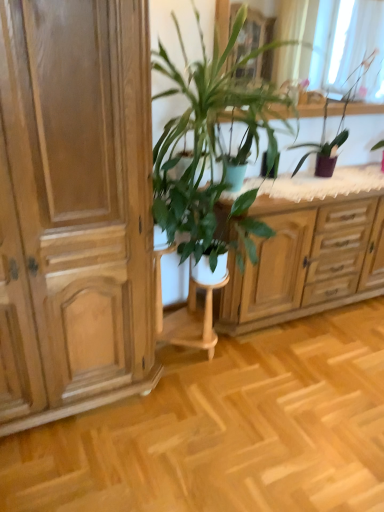
What do you see at coordinates (264, 165) in the screenshot? This screenshot has width=384, height=512. I see `green matte flowerpot at center` at bounding box center [264, 165].

What do you see at coordinates (337, 128) in the screenshot? Image resolution: width=384 pixels, height=512 pixels. I see `purple glossy vase at upper right, which ranks as the second houseplant in left-to-right order` at bounding box center [337, 128].

Identify the location of light wood cabinet at center. Image resolution: width=384 pixels, height=512 pixels. pyautogui.click(x=302, y=266).

Is translucent fabric at upper center oriented away from green matte flowerpot at center?

No, translucent fabric at upper center is not facing the opposite direction of green matte flowerpot at center.

Are translucent fabric at upper center and green matte flowerpot at center making contact?

No, translucent fabric at upper center is not next to green matte flowerpot at center.

Is translucent fabric at upper center taller or shorter than green matte flowerpot at center?

In the image, translucent fabric at upper center appears to be taller than green matte flowerpot at center.

From a real-world perspective, who is located higher, translucent fabric at upper center or green matte flowerpot at center?

From a 3D spatial view, translucent fabric at upper center is above.

Considering the points (91, 190) and (293, 277), which point is in front, point (91, 190) or point (293, 277)?

The point (91, 190) is in front.

Is light brown wood cabinet at left spatially inside light wood cabinet at center, or outside of it?

light brown wood cabinet at left is not inside light wood cabinet at center, it's outside.

Where is `cabinetry above the light wood cabinet at center (from the image's perspective)`? The height and width of the screenshot is (512, 384). cabinetry above the light wood cabinet at center (from the image's perspective) is located at coordinates (75, 208).

Consider the image. Is light brown wood cabinet at left not close to light wood cabinet at center?

Yes, light brown wood cabinet at left and light wood cabinet at center are located far from each other.

Based on the photo, is translucent fabric at upper center directly adjacent to purple glossy vase at upper right, which is the first houseplant from right to left?

No, translucent fabric at upper center is not beside purple glossy vase at upper right, which is the first houseplant from right to left.

Is translucent fabric at upper center to the left of purple glossy vase at upper right, which is the first houseplant from right to left, from the viewer's perspective?

Indeed, translucent fabric at upper center is positioned on the left side of purple glossy vase at upper right, which is the first houseplant from right to left.

How distant is translucent fabric at upper center from purple glossy vase at upper right, which ranks as the second houseplant in left-to-right order?

A distance of 25.26 inches exists between translucent fabric at upper center and purple glossy vase at upper right, which ranks as the second houseplant in left-to-right order.

From the image's perspective, would you say translucent fabric at upper center is shown under purple glossy vase at upper right, which is the first houseplant from right to left?

No, from the image's perspective, translucent fabric at upper center is not beneath purple glossy vase at upper right, which is the first houseplant from right to left.

Considering the sizes of translucent fabric at upper center and light wood cabinet at center in the image, is translucent fabric at upper center taller or shorter than light wood cabinet at center?

Considering their sizes, translucent fabric at upper center has less height than light wood cabinet at center.

Considering the relative positions of translucent fabric at upper center and light wood cabinet at center in the image provided, is translucent fabric at upper center to the right of light wood cabinet at center from the viewer's perspective?

No, translucent fabric at upper center is not to the right of light wood cabinet at center.

From the image's perspective, is translucent fabric at upper center beneath light wood cabinet at center?

Incorrect, from the image's perspective, translucent fabric at upper center is higher than light wood cabinet at center.

Considering the sizes of objects translucent fabric at upper center and light wood cabinet at center in the image provided, who is bigger, translucent fabric at upper center or light wood cabinet at center?

light wood cabinet at center.

Considering the sizes of objects green matte flowerpot at center and green leafy plant at center, which is the first houseplant in left-to-right order, in the image provided, who is thinner, green matte flowerpot at center or green leafy plant at center, which is the first houseplant in left-to-right order,?

green matte flowerpot at center is thinner.

Considering the relative sizes of green matte flowerpot at center and green leafy plant at center, which is the second houseplant in right-to-left order, in the image provided, is green matte flowerpot at center taller than green leafy plant at center, which is the second houseplant in right-to-left order,?

No, green matte flowerpot at center is not taller than green leafy plant at center, which is the second houseplant in right-to-left order.

Is light wood cabinet at center turned away from green leafy plant at center, which is the second houseplant in right-to-left order?

light wood cabinet at center is not turned away from green leafy plant at center, which is the second houseplant in right-to-left order.

Measure the distance between light wood cabinet at center and green leafy plant at center, which is the first houseplant in left-to-right order.

light wood cabinet at center and green leafy plant at center, which is the first houseplant in left-to-right order, are 19.67 inches apart.

Which of these two, light wood cabinet at center or green leafy plant at center, which is the second houseplant in right-to-left order, is wider?

green leafy plant at center, which is the second houseplant in right-to-left order, is wider.

Where is `chest of drawers below the green leafy plant at center, which is the first houseplant in left-to-right order (from the image's perspective)`? The height and width of the screenshot is (512, 384). chest of drawers below the green leafy plant at center, which is the first houseplant in left-to-right order (from the image's perspective) is located at coordinates (302, 266).

Is green matte flowerpot at center closer to camera compared to light wood cabinet at center?

That is False.

Is green matte flowerpot at center at the left side of light wood cabinet at center?

Correct, you'll find green matte flowerpot at center to the left of light wood cabinet at center.

Looking at this image, could you tell me if green matte flowerpot at center is turned towards light wood cabinet at center?

No, green matte flowerpot at center is not oriented towards light wood cabinet at center.

Find the location of a particular element. The height and width of the screenshot is (512, 384). flowerpot below the translucent fabric at upper center (from a real-world perspective) is located at coordinates (264, 165).

In the image, there is a light wood cabinet at center. Identify the location of cabinetry above it (from the image's perspective). (75, 208).

Estimate the real-world distances between objects in this image. Which object is further from green leafy plant at center, which is the second houseplant in right-to-left order, light brown wood cabinet at left or translucent fabric at upper center?

The object further to green leafy plant at center, which is the second houseplant in right-to-left order, is translucent fabric at upper center.

From the image, which object appears to be nearer to purple glossy vase at upper right, which is the first houseplant from right to left, translucent fabric at upper center or green leafy plant at center, which is the first houseplant in left-to-right order?

The object closer to purple glossy vase at upper right, which is the first houseplant from right to left, is translucent fabric at upper center.

From the image, which object appears to be farther from light brown wood cabinet at left, purple glossy vase at upper right, which ranks as the second houseplant in left-to-right order, or light wood cabinet at center?

purple glossy vase at upper right, which ranks as the second houseplant in left-to-right order, lies further to light brown wood cabinet at left than the other object.

Based on their spatial positions, is translucent fabric at upper center or purple glossy vase at upper right, which is the first houseplant from right to left, further from light brown wood cabinet at left?

The object further to light brown wood cabinet at left is translucent fabric at upper center.

From the image, which object appears to be nearer to light brown wood cabinet at left, translucent fabric at upper center or light wood cabinet at center?

light wood cabinet at center is positioned closer to the anchor light brown wood cabinet at left.

Which object lies further to the anchor point purple glossy vase at upper right, which ranks as the second houseplant in left-to-right order, green matte flowerpot at center or light brown wood cabinet at left?

Among the two, light brown wood cabinet at left is located further to purple glossy vase at upper right, which ranks as the second houseplant in left-to-right order.

Looking at this image, which object lies nearer to the anchor point light wood cabinet at center, translucent fabric at upper center or purple glossy vase at upper right, which ranks as the second houseplant in left-to-right order?

Based on the image, purple glossy vase at upper right, which ranks as the second houseplant in left-to-right order, appears to be nearer to light wood cabinet at center.

When comparing their distances from green matte flowerpot at center, does green leafy plant at center, which is the first houseplant in left-to-right order, or light wood cabinet at center seem further?

The object further to green matte flowerpot at center is light wood cabinet at center.

Find the location of a particular element. The width and height of the screenshot is (384, 512). houseplant between light brown wood cabinet at left and purple glossy vase at upper right, which ranks as the second houseplant in left-to-right order is located at coordinates (209, 140).

This screenshot has width=384, height=512. Identify the location of houseplant located between green leafy plant at center, which is the first houseplant in left-to-right order, and green matte flowerpot at center in the depth direction. (337, 128).

This screenshot has width=384, height=512. In order to click on the chest of drawers positioned between green leafy plant at center, which is the second houseplant in right-to-left order, and purple glossy vase at upper right, which ranks as the second houseplant in left-to-right order, from near to far in this screenshot , I will do `click(302, 266)`.

The height and width of the screenshot is (512, 384). Find the location of `flowerpot between translucent fabric at upper center and light wood cabinet at center in the up-down direction`. flowerpot between translucent fabric at upper center and light wood cabinet at center in the up-down direction is located at coordinates (264, 165).